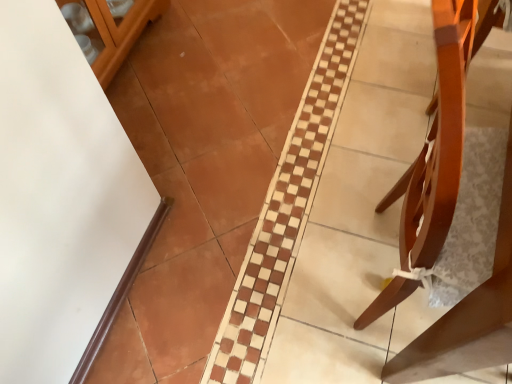
The height and width of the screenshot is (384, 512). In order to click on light brown wood chair at right in this screenshot , I will do `click(440, 135)`.

What do you see at coordinates (440, 135) in the screenshot? This screenshot has height=384, width=512. I see `light brown wood chair at right` at bounding box center [440, 135].

Find the location of `white glossy glass door at upper left`. white glossy glass door at upper left is located at coordinates (109, 29).

Describe the element at coordinates (109, 29) in the screenshot. The height and width of the screenshot is (384, 512). I see `white glossy glass door at upper left` at that location.

What is the approximate height of white glossy glass door at upper left?

The height of white glossy glass door at upper left is 18.13 inches.

I want to click on light brown wood chair at right, so click(440, 135).

Considering the relative positions of light brown wood chair at right and white glossy glass door at upper left in the image provided, is light brown wood chair at right to the right of white glossy glass door at upper left from the viewer's perspective?

Yes.

Considering the relative positions of light brown wood chair at right and white glossy glass door at upper left in the image provided, is light brown wood chair at right behind white glossy glass door at upper left?

That is False.

Considering the points (419, 173) and (85, 13), which point is behind, point (419, 173) or point (85, 13)?

Point (85, 13)

Looking at this image, from the image's perspective, is light brown wood chair at right located above or below white glossy glass door at upper left?

light brown wood chair at right is below white glossy glass door at upper left.

From a real-world perspective, who is located higher, light brown wood chair at right or white glossy glass door at upper left?

light brown wood chair at right.

From the picture: Between light brown wood chair at right and white glossy glass door at upper left, which one has larger width?

Wider between the two is light brown wood chair at right.

Considering the sizes of light brown wood chair at right and white glossy glass door at upper left in the image, is light brown wood chair at right taller or shorter than white glossy glass door at upper left?

In the image, light brown wood chair at right appears to be taller than white glossy glass door at upper left.

Which of these two, light brown wood chair at right or white glossy glass door at upper left, is smaller?

Smaller between the two is white glossy glass door at upper left.

Is light brown wood chair at right situated inside white glossy glass door at upper left or outside?

light brown wood chair at right is located beyond the bounds of white glossy glass door at upper left.

Is light brown wood chair at right placed right next to white glossy glass door at upper left?

No, light brown wood chair at right is not in contact with white glossy glass door at upper left.

Does light brown wood chair at right turn towards white glossy glass door at upper left?

Yes, light brown wood chair at right is facing white glossy glass door at upper left.

How different are the orientations of light brown wood chair at right and white glossy glass door at upper left in degrees?

The angular difference between light brown wood chair at right and white glossy glass door at upper left is 178 degrees.

In order to click on furniture located above the white glossy glass door at upper left (from a real-world perspective) in this screenshot , I will do `click(440, 135)`.

Can you confirm if white glossy glass door at upper left is positioned to the left of light brown wood chair at right?

Yes.

Which is behind, white glossy glass door at upper left or light brown wood chair at right?

white glossy glass door at upper left is behind.

Which is closer, (90,49) or (486,18)?

Point (90,49) is positioned farther from the camera compared to point (486,18).

From the image's perspective, which one is positioned higher, white glossy glass door at upper left or light brown wood chair at right?

From the image's view, white glossy glass door at upper left is above.

From a real-world perspective, is white glossy glass door at upper left physically located above or below light brown wood chair at right?

white glossy glass door at upper left is situated lower than light brown wood chair at right in the real world.

Considering the sizes of white glossy glass door at upper left and light brown wood chair at right in the image, is white glossy glass door at upper left wider or thinner than light brown wood chair at right?

Considering their sizes, white glossy glass door at upper left looks slimmer than light brown wood chair at right.

Considering the sizes of white glossy glass door at upper left and light brown wood chair at right in the image, is white glossy glass door at upper left taller or shorter than light brown wood chair at right?

In the image, white glossy glass door at upper left appears to be shorter than light brown wood chair at right.

Considering the sizes of objects white glossy glass door at upper left and light brown wood chair at right in the image provided, who is smaller, white glossy glass door at upper left or light brown wood chair at right?

white glossy glass door at upper left.

Could light brown wood chair at right be considered to be inside white glossy glass door at upper left?

No, light brown wood chair at right is located outside of white glossy glass door at upper left.

Is white glossy glass door at upper left far from light brown wood chair at right?

Yes, white glossy glass door at upper left is far from light brown wood chair at right.

Is white glossy glass door at upper left oriented away from light brown wood chair at right?

No.

Where is `glass door located behind the light brown wood chair at right`? glass door located behind the light brown wood chair at right is located at coordinates (109, 29).

Locate an element on the screen. This screenshot has height=384, width=512. furniture on the right of white glossy glass door at upper left is located at coordinates (440, 135).

Image resolution: width=512 pixels, height=384 pixels. Identify the location of furniture below the white glossy glass door at upper left (from the image's perspective). (440, 135).